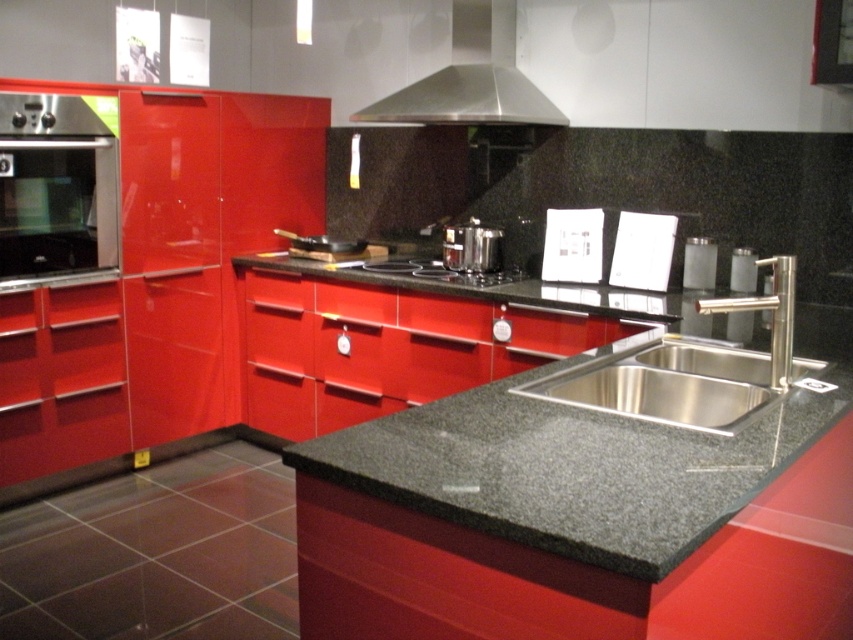
Question: Is satin silver exhaust hood at upper center further to the viewer compared to satin silver pot at center?

Choices:
 (A) no
 (B) yes

Answer: (A)

Question: Considering the real-world distances, which object is closest to the stainless steel sink at center?

Choices:
 (A) satin silver exhaust hood at upper center
 (B) stainless steel oven at left
 (C) polished stainless steel faucet at sink right
 (D) granite countertop at center

Answer: (C)

Question: Is stainless steel oven at left to the left of satin silver exhaust hood at upper center from the viewer's perspective?

Choices:
 (A) yes
 (B) no

Answer: (A)

Question: Which point appears closest to the camera in this image?

Choices:
 (A) (486, 253)
 (B) (39, 253)

Answer: (B)

Question: Is satin silver exhaust hood at upper center smaller than polished stainless steel faucet at sink right?

Choices:
 (A) yes
 (B) no

Answer: (B)

Question: Estimate the real-world distances between objects in this image. Which object is farther from the stainless steel oven at left?

Choices:
 (A) granite countertop at center
 (B) polished stainless steel faucet at sink right
 (C) stainless steel sink at center

Answer: (B)